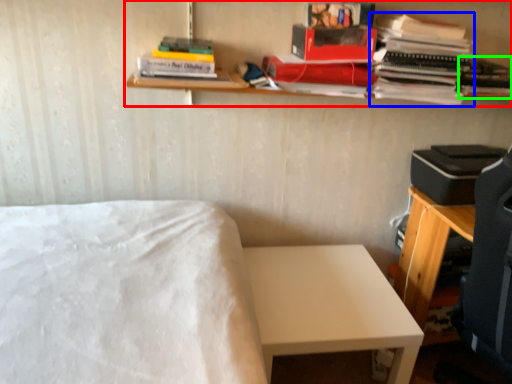
Question: Which is farther away from shelf (highlighted by a red box)? book (highlighted by a blue box) or book (highlighted by a green box)?

Choices:
 (A) book
 (B) book

Answer: (A)